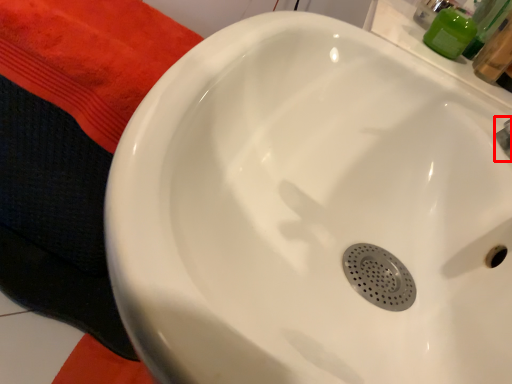
Question: From the image's perspective, where is plumbing fixture (annotated by the red box) located relative to toiletry?

Choices:
 (A) above
 (B) below

Answer: (B)